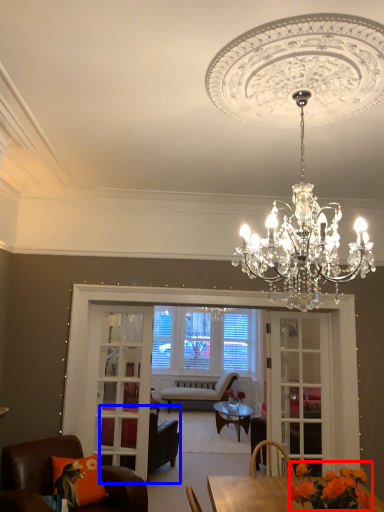
Question: Which object appears farthest to the camera in this image, flower (highlighted by a red box) or chair (highlighted by a blue box)?

Choices:
 (A) flower
 (B) chair

Answer: (B)